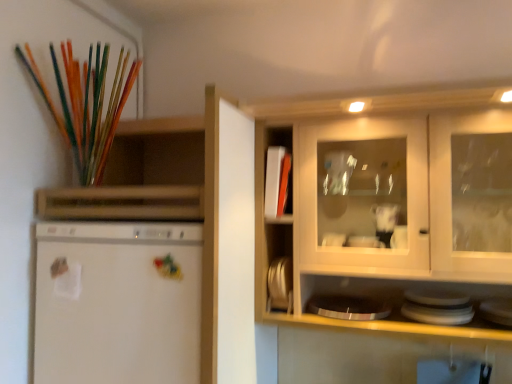
Question: Does white matte refrigerator at left have a lesser width compared to white glossy plate at lower right, placed as the 1th appliance when sorted from front to back?

Choices:
 (A) yes
 (B) no

Answer: (B)

Question: Is white matte refrigerator at left wider than white glossy plate at lower right, placed as the 1th appliance when sorted from front to back?

Choices:
 (A) yes
 (B) no

Answer: (A)

Question: From a real-world perspective, is white matte refrigerator at left physically above white glossy plate at lower right, which is the second appliance from back to front?

Choices:
 (A) no
 (B) yes

Answer: (A)

Question: Does white matte refrigerator at left have a greater height compared to white glossy plate at lower right, positioned as the first appliance in right-to-left order?

Choices:
 (A) yes
 (B) no

Answer: (A)

Question: Is white matte refrigerator at left outside of white glossy plate at lower right, which is the second appliance from back to front?

Choices:
 (A) yes
 (B) no

Answer: (A)

Question: Considering the positions of white glossy plate at lower right, positioned as the first appliance in right-to-left order, and white matte cabinet at center in the image, is white glossy plate at lower right, positioned as the first appliance in right-to-left order, taller or shorter than white matte cabinet at center?

Choices:
 (A) tall
 (B) short

Answer: (B)

Question: From the image's perspective, is white glossy plate at lower right, which is the second appliance from back to front, located above or below white matte cabinet at center?

Choices:
 (A) below
 (B) above

Answer: (A)

Question: In the image, is white glossy plate at lower right, acting as the second appliance starting from the left, on the left side or the right side of white matte cabinet at center?

Choices:
 (A) left
 (B) right

Answer: (B)

Question: Looking at the image, does white glossy plate at lower right, which is the second appliance from back to front, seem bigger or smaller compared to white matte cabinet at center?

Choices:
 (A) small
 (B) big

Answer: (A)

Question: Is white matte refrigerator at left in front of or behind metallic silver plates at center, the second appliance in the front-to-back sequence, in the image?

Choices:
 (A) behind
 (B) front

Answer: (B)

Question: Would you say white matte refrigerator at left is to the left or to the right of metallic silver plates at center, the second appliance in the right-to-left sequence, in the picture?

Choices:
 (A) left
 (B) right

Answer: (A)

Question: Looking at their shapes, would you say white matte refrigerator at left is wider or thinner than metallic silver plates at center, the first appliance when ordered from back to front?

Choices:
 (A) wide
 (B) thin

Answer: (A)

Question: Would you say white matte refrigerator at left is inside or outside metallic silver plates at center, the second appliance in the front-to-back sequence?

Choices:
 (A) outside
 (B) inside

Answer: (A)

Question: From a real-world perspective, relative to white matte refrigerator at left, is white glossy plate at lower right, positioned as the first appliance in right-to-left order, vertically above or below?

Choices:
 (A) above
 (B) below

Answer: (A)

Question: From the image's perspective, is white glossy plate at lower right, positioned as the first appliance in right-to-left order, located above or below white matte refrigerator at left?

Choices:
 (A) below
 (B) above

Answer: (B)